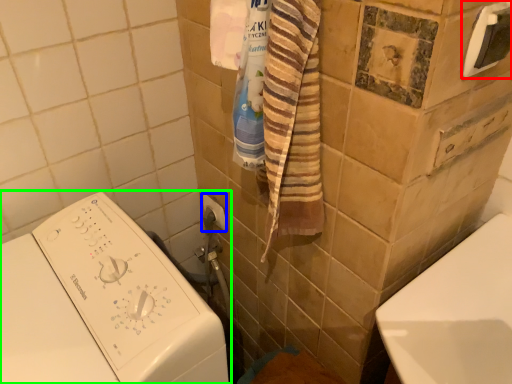
Question: Which object is positioned closest to towel bar (highlighted by a red box)? Select from towel bar (highlighted by a blue box) and washing machine (highlighted by a green box).

Choices:
 (A) towel bar
 (B) washing machine

Answer: (B)